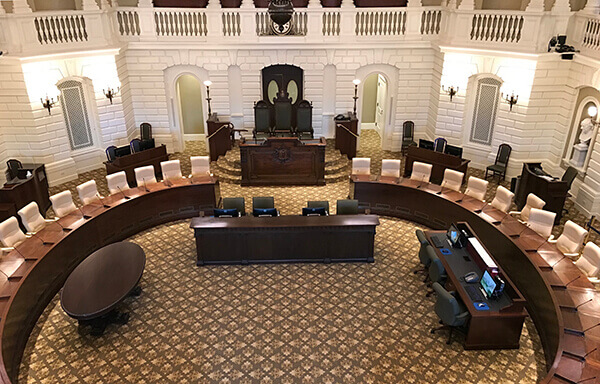
This screenshot has width=600, height=384. In order to click on white brick wall in this screenshot , I will do `click(532, 99)`, `click(143, 96)`.